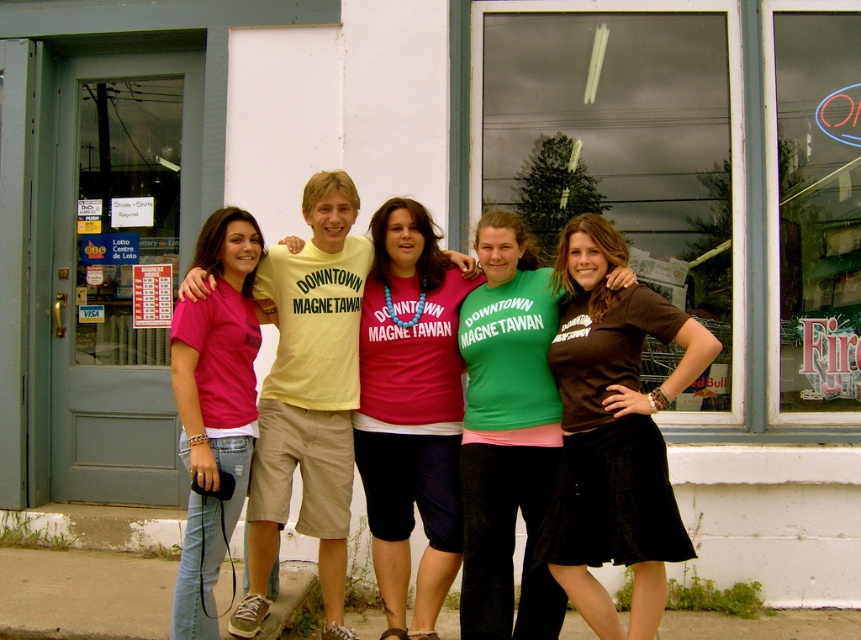
In the scene shown: You are a photographer taking a group photo of the matte pink shirt at center and the green matte shirt at center. Which shirt should be positioned closer to the camera to ensure both are in focus?

The matte pink shirt at center is taller than the green matte shirt at center, so positioning the taller matte pink shirt at center closer to the camera will help keep both shirts in focus by reducing the depth of field difference between them.

You are standing at the point with coordinates point (230,260) and want to move to the point with coordinates point (409,314). Given that you can only move forward in a straight line, will you be able to reach your destination without changing direction?

Point (409,314) is behind point (230,260), so moving forward in a straight line from point (230,260) will not allow you to reach point (409,314) without changing direction.